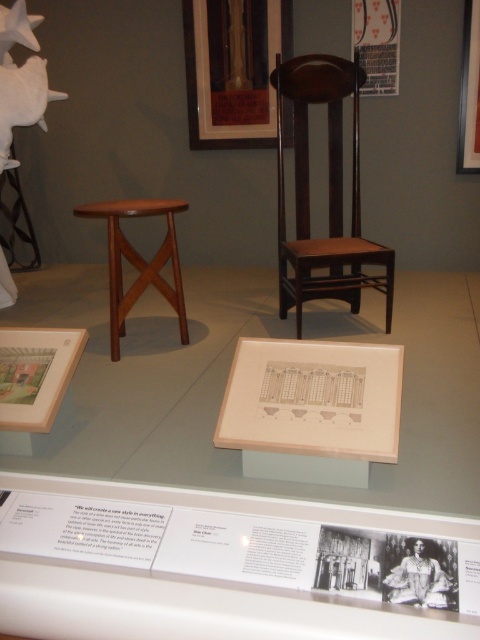
Identify the location of matte wood picture frame at upper center. The image size is (480, 640). (233, 68).

Does matte wood picture frame at upper center come behind mahogany wood stool at center?

That is True.

Is point (288, 22) positioned behind point (135, 252)?

Yes, it is.

Where is `matte wood picture frame at upper center`? The image size is (480, 640). matte wood picture frame at upper center is located at coordinates (233, 68).

Who is shorter, mahogany wood chair at center or mahogany wood stool at center?

Standing shorter between the two is mahogany wood stool at center.

Is mahogany wood chair at center positioned in front of mahogany wood stool at center?

No, mahogany wood chair at center is further to the viewer.

I want to click on mahogany wood chair at center, so click(x=328, y=193).

Which is more to the left, matte wood picture frame at upper center or matte white picture frame at upper right?

From the viewer's perspective, matte wood picture frame at upper center appears more on the left side.

Is matte wood picture frame at upper center in front of matte white picture frame at upper right?

No, matte wood picture frame at upper center is further to the viewer.

Is point (199, 28) more distant than point (476, 76)?

Yes, it is.

I want to click on matte wood picture frame at upper center, so click(x=233, y=68).